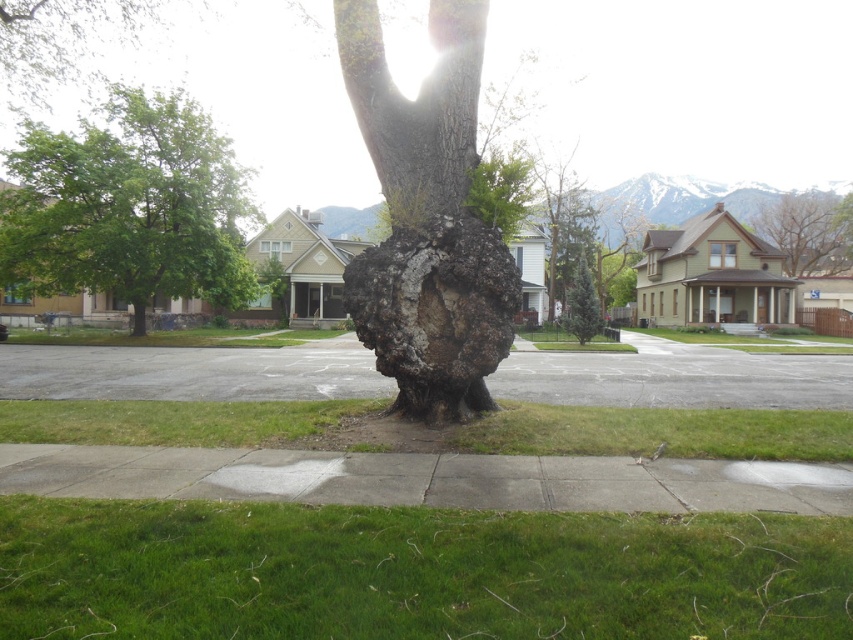
Based on the photo, who is more forward, (566, 378) or (425, 177)?

Point (425, 177)

Based on the photo, measure the distance from gray asphalt pavement at center to smooth bark tree trunk at center.

gray asphalt pavement at center is 16.04 meters away from smooth bark tree trunk at center.

Consider the image. Who is more distant from viewer, (119,372) or (387,200)?

Positioned behind is point (119,372).

Locate an element on the screen. gray asphalt pavement at center is located at coordinates (192, 372).

Is point (71, 577) farther from viewer compared to point (595, 310)?

No, it is not.

Who is higher up, green grass at lower center or green textured tree at center?

green textured tree at center

Does point (90, 570) lie in front of point (582, 296)?

Yes.

Where is `green grass at lower center`? green grass at lower center is located at coordinates (413, 573).

The height and width of the screenshot is (640, 853). Identify the location of cracked bark tree trunk at center. (427, 218).

Looking at this image, is cracked bark tree trunk at center behind green grass at center?

Yes, cracked bark tree trunk at center is behind green grass at center.

Where is `cracked bark tree trunk at center`? The image size is (853, 640). cracked bark tree trunk at center is located at coordinates (427, 218).